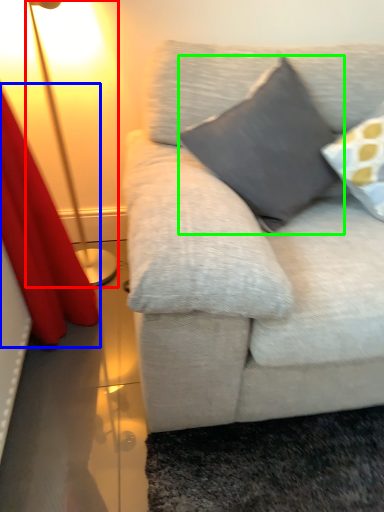
Question: Which is nearer to the lamp (highlighted by a red box)? curtain (highlighted by a blue box) or pillow (highlighted by a green box).

Choices:
 (A) curtain
 (B) pillow

Answer: (A)